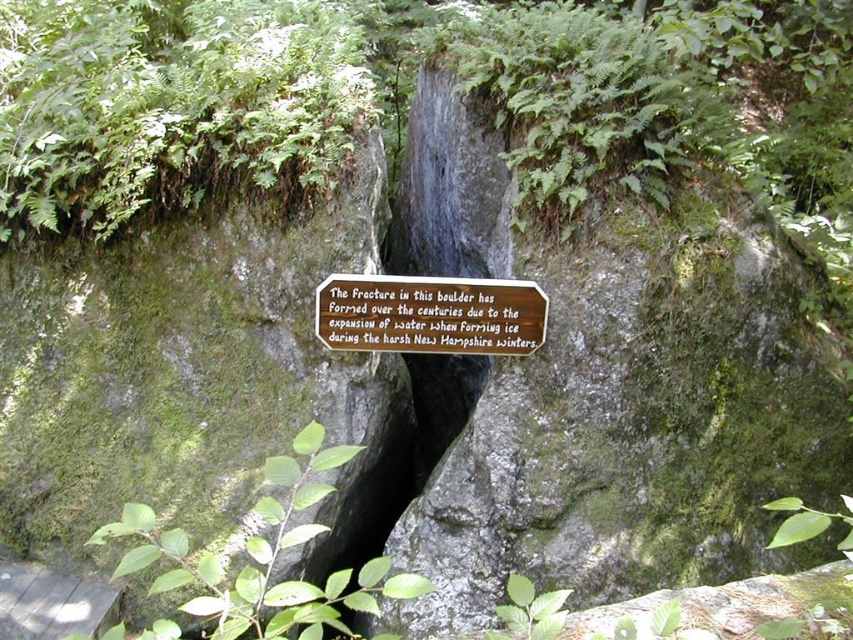
Is point (440, 401) farther from camera compared to point (335, 321)?

That is True.

Who is taller, green mossy rock at center or bronze plaque at center?

green mossy rock at center is taller.

What do you see at coordinates (604, 390) in the screenshot? I see `green mossy rock at center` at bounding box center [604, 390].

Identify the location of green mossy rock at center. The image size is (853, 640). [604, 390].